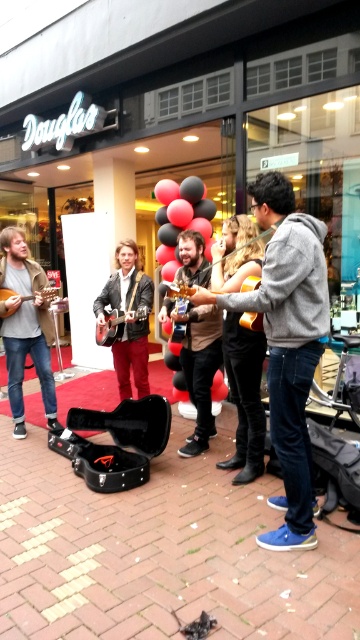
You are a photographer positioned in front of the Douglas storefront. You want to take a photo of the black matte balloons at center and the matte brown acoustic guitar at left. Based on their positions, which object should you place on the right side of your photo frame?

The black matte balloons at center should be placed on the right side of your photo frame because they are located to the right of the matte brown acoustic guitar at left.

You are a photographer wanting to capture a photo of the gray hoodie at center and the black matte balloons at center. Since you want to ensure both are fully visible, which object should you focus on to frame the shot properly?

The gray hoodie at center is wider than the black matte balloons at center. Therefore, focusing on the gray hoodie at center ensures the entire width of both objects fits within the frame.